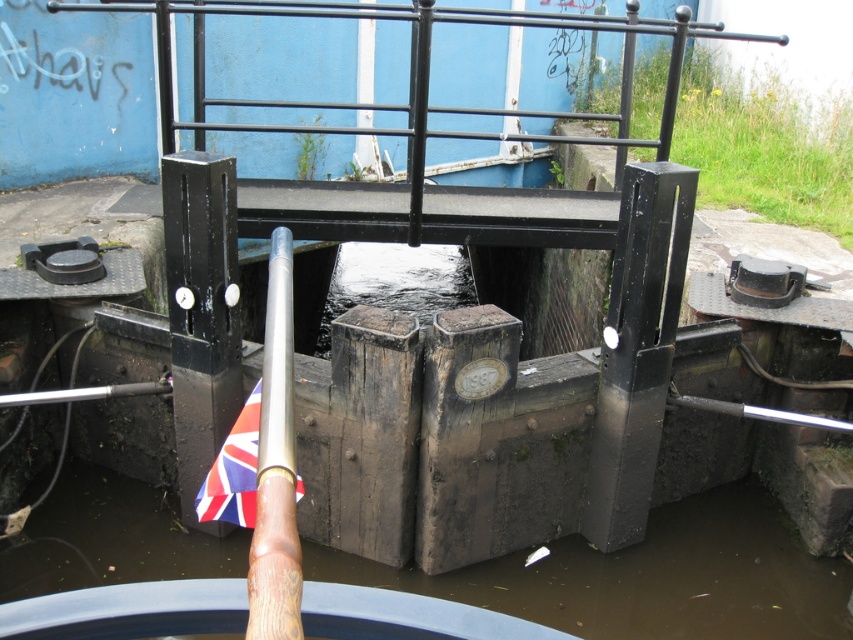
In the scene shown: Between brown wooden paddle at lower center and silver polished wood pole at center, which one is positioned lower?

Positioned lower is brown wooden paddle at lower center.

Is brown wooden paddle at lower center wider than silver polished wood pole at center?

Indeed, brown wooden paddle at lower center has a greater width compared to silver polished wood pole at center.

The width and height of the screenshot is (853, 640). What are the coordinates of `brown wooden paddle at lower center` in the screenshot? It's located at (648, 577).

You are a GUI agent. You are given a task and a screenshot of the screen. Output one action in this format:
    pyautogui.click(x=<x>, y=<y>)
    Task: Click on the brown wooden paddle at lower center
    
    Given the screenshot: What is the action you would take?
    pyautogui.click(x=648, y=577)

Can you confirm if silver polished wood pole at center is wider than union jack fabric at center?

Incorrect, silver polished wood pole at center's width does not surpass union jack fabric at center's.

Who is more distant from viewer, [277,429] or [228,515]?

Point [228,515]

Image resolution: width=853 pixels, height=640 pixels. In order to click on silver polished wood pole at center in this screenshot , I will do `click(276, 467)`.

Is brown wooden paddle at lower center to the left of union jack fabric at center from the viewer's perspective?

No, brown wooden paddle at lower center is not to the left of union jack fabric at center.

Which of these two, brown wooden paddle at lower center or union jack fabric at center, stands shorter?

Standing shorter between the two is brown wooden paddle at lower center.

This screenshot has height=640, width=853. What do you see at coordinates (648, 577) in the screenshot?
I see `brown wooden paddle at lower center` at bounding box center [648, 577].

Locate an element on the screen. This screenshot has height=640, width=853. brown wooden paddle at lower center is located at coordinates (648, 577).